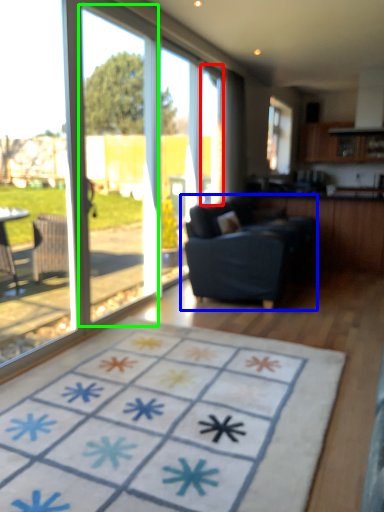
Question: Estimate the real-world distances between objects in this image. Which object is farther from window screen (highlighted by a red box), studio couch (highlighted by a blue box) or screen door (highlighted by a green box)?

Choices:
 (A) studio couch
 (B) screen door

Answer: (B)